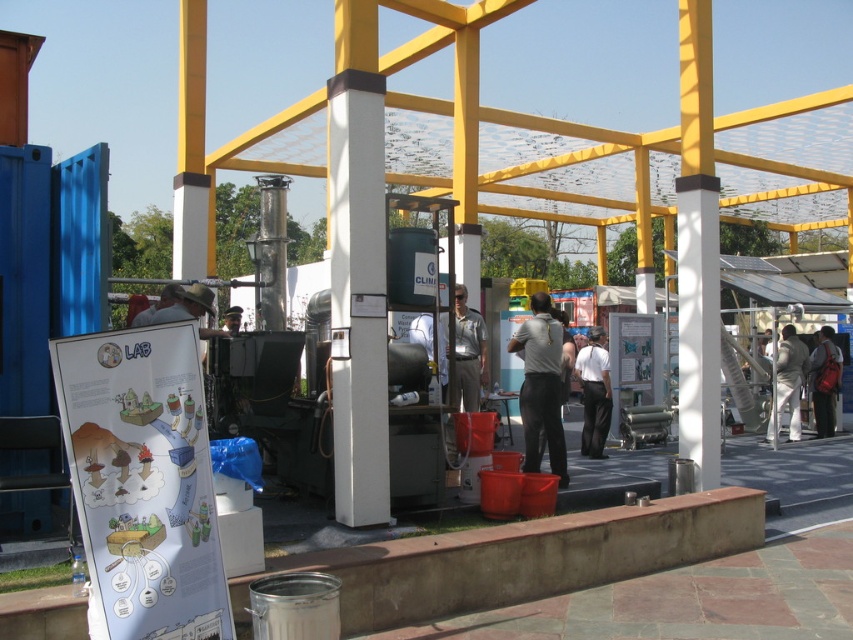
Question: Is white smooth shirt at center positioned before matte gray helmet at left?

Choices:
 (A) yes
 (B) no

Answer: (B)

Question: Which point is farther to the camera?

Choices:
 (A) dark gray uniform at center
 (B) matte gray helmet at left
 (C) gray fabric jacket at center

Answer: (C)

Question: Among these points, which one is nearest to the camera?

Choices:
 (A) (229, 326)
 (B) (209, 304)

Answer: (B)

Question: Estimate the real-world distances between objects in this image. Which object is farther from the matte gray helmet at left?

Choices:
 (A) white smooth shirt at center
 (B) brown fabric hat at center
 (C) gray fabric jacket at center
 (D) brown leather hat at center

Answer: (C)

Question: Can you confirm if brown fabric hat at center is positioned to the left of matte gray helmet at left?

Choices:
 (A) no
 (B) yes

Answer: (A)

Question: Does gray fabric jacket at center appear on the right side of red backpack at right?

Choices:
 (A) yes
 (B) no

Answer: (B)